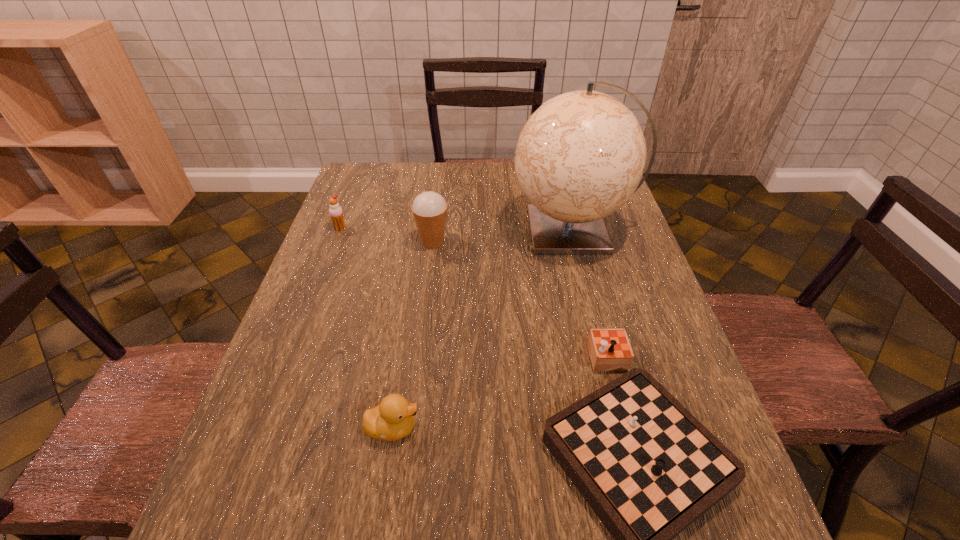
I want to click on vacant position in the image that satisfies the following two spatial constraints: 1. at the front with a straw on the third shortest object; 2. on the left side of the right icecream, so click(335, 242).